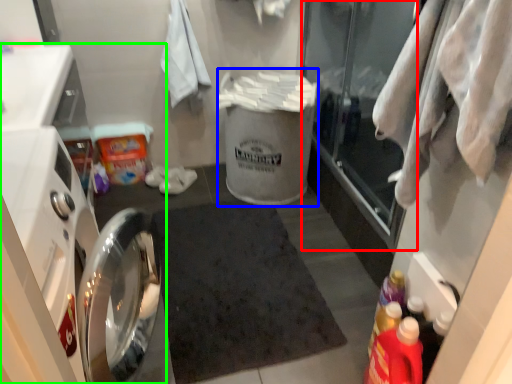
Question: Considering the real-world distances, which object is closest to glass door (highlighted by a red box)? garbage (highlighted by a blue box) or dish washer (highlighted by a green box).

Choices:
 (A) garbage
 (B) dish washer

Answer: (A)